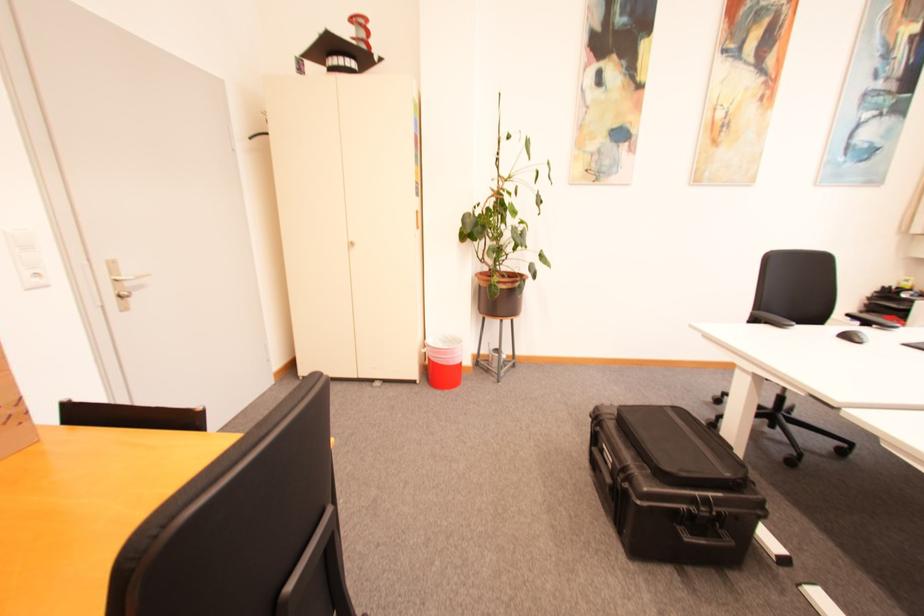
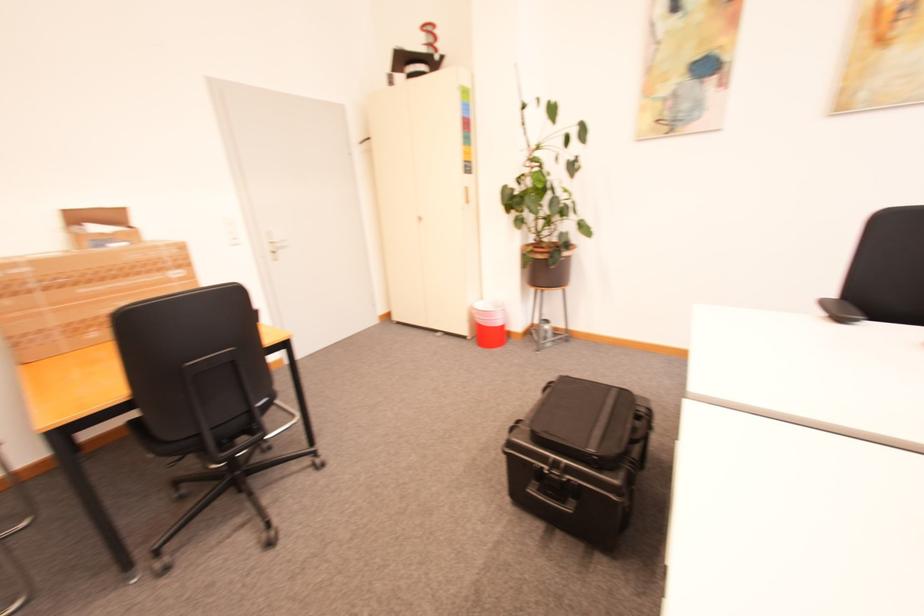
In the second image, find the point that corresponds to (x=505, y=283) in the first image.

(539, 253)